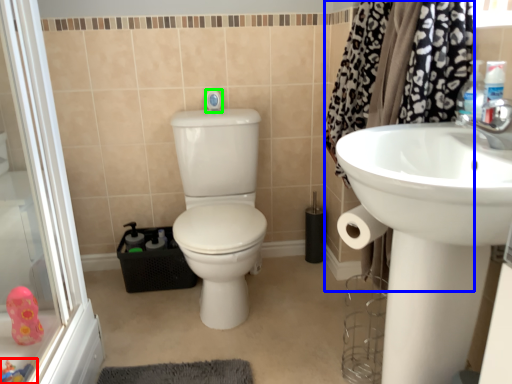
Question: Which is farther away from toy (highlighted by a red box)? shower curtain (highlighted by a blue box) or shower (highlighted by a green box)?

Choices:
 (A) shower curtain
 (B) shower

Answer: (A)